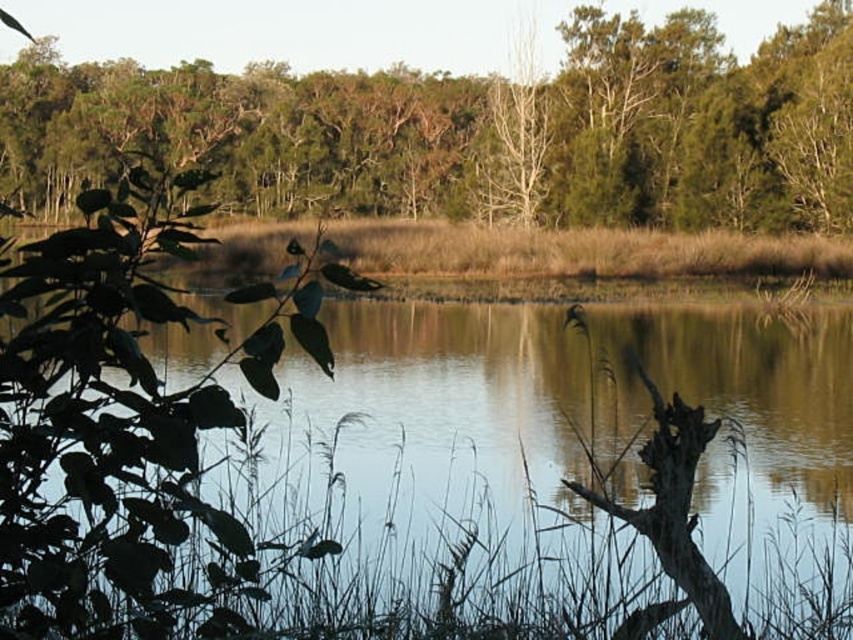
Is green grass at lower left further to the viewer compared to green leafy tree at upper center?

No, green grass at lower left is in front of green leafy tree at upper center.

Does green grass at lower left appear under green leafy tree at upper center?

Yes, green grass at lower left is below green leafy tree at upper center.

The width and height of the screenshot is (853, 640). In order to click on green grass at lower left in this screenshot , I will do `click(440, 490)`.